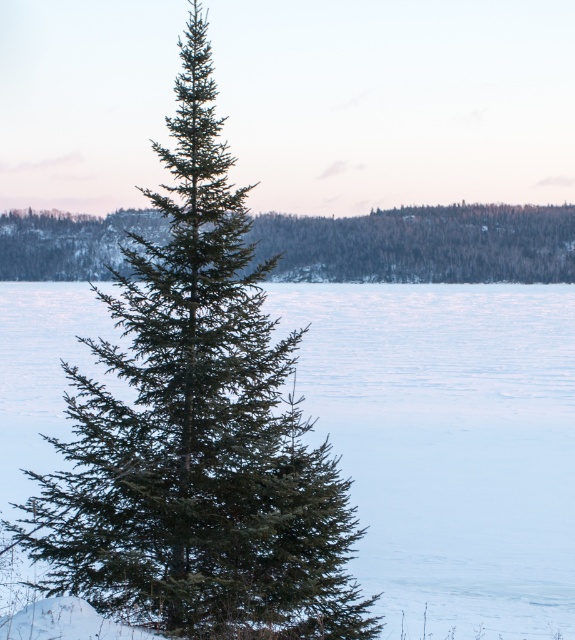
Which is behind, point (296, 429) or point (488, 305)?

Positioned behind is point (488, 305).

Who is lower down, green matte fir tree at center or white ice at center?

green matte fir tree at center is below.

Is point (267, 499) behind point (480, 563)?

No, (267, 499) is closer to viewer.

Where is `green matte fir tree at center`? This screenshot has width=575, height=640. green matte fir tree at center is located at coordinates (198, 432).

Does white ice at center appear on the right side of green matte evergreen tree at center?

Incorrect, white ice at center is not on the right side of green matte evergreen tree at center.

Does point (21, 353) come closer to viewer compared to point (10, 243)?

Yes, it is in front of point (10, 243).

Does point (416, 308) come farther from viewer compared to point (559, 253)?

No, (416, 308) is closer to viewer.

Locate an element on the screen. This screenshot has height=640, width=575. white ice at center is located at coordinates (448, 444).

Between green matte fir tree at center and green matte evergreen tree at center, which one appears on the left side from the viewer's perspective?

From the viewer's perspective, green matte fir tree at center appears more on the left side.

This screenshot has width=575, height=640. Describe the element at coordinates (198, 432) in the screenshot. I see `green matte fir tree at center` at that location.

What do you see at coordinates (198, 432) in the screenshot?
I see `green matte fir tree at center` at bounding box center [198, 432].

Identify the location of green matte fir tree at center. (198, 432).